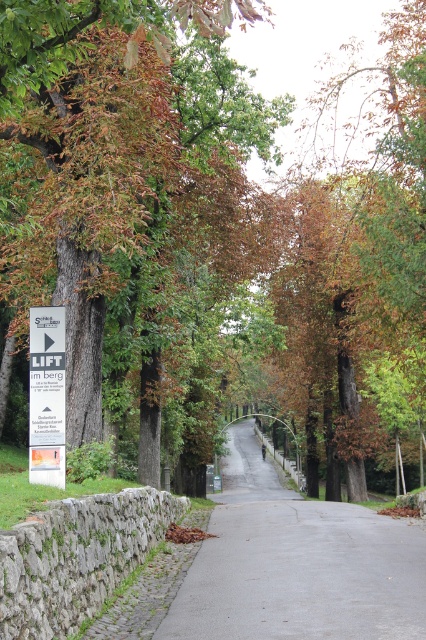
Question: Which point is closer to the camera?

Choices:
 (A) white plastic sign at left
 (B) gray asphalt road at center

Answer: (B)

Question: Which point is closer to the camera?

Choices:
 (A) (45, 433)
 (B) (176, 608)

Answer: (B)

Question: In this image, where is gray asphalt road at center located relative to white plastic sign at left?

Choices:
 (A) below
 (B) above

Answer: (A)

Question: From the image, what is the correct spatial relationship of gray asphalt road at center in relation to white plastic sign at left?

Choices:
 (A) left
 (B) right

Answer: (B)

Question: Is gray asphalt road at center smaller than white plastic sign at left?

Choices:
 (A) yes
 (B) no

Answer: (B)